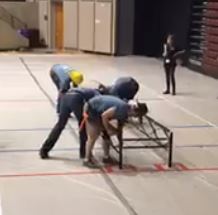
The width and height of the screenshot is (218, 215). Identify the location of red chairs stacked up. (211, 69), (210, 59), (210, 51), (211, 44), (212, 34), (213, 28), (212, 23), (212, 5), (216, 14).